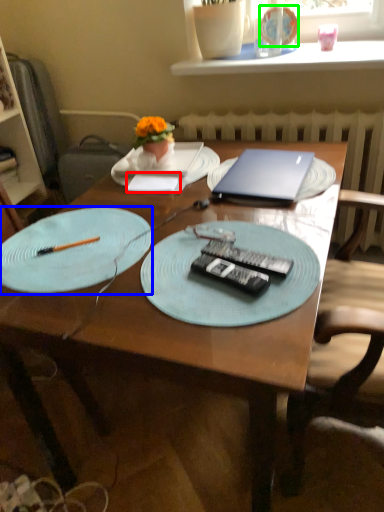
Question: Which object is the farthest from notepad (highlighted by a red box)? Choose among these: plate (highlighted by a blue box) or tableware (highlighted by a green box).

Choices:
 (A) plate
 (B) tableware

Answer: (B)